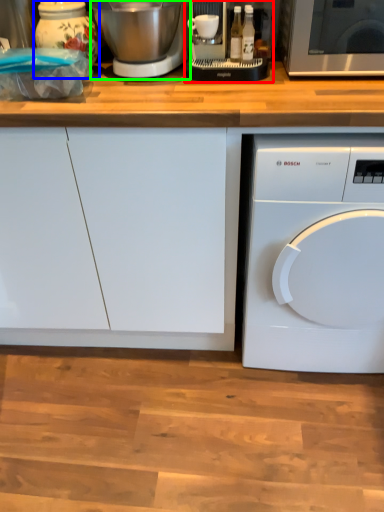
Question: Based on their relative distances, which object is nearer to food processor (highlighted by a red box)? Choose from appliance (highlighted by a blue box) and mixer (highlighted by a green box).

Choices:
 (A) appliance
 (B) mixer

Answer: (B)